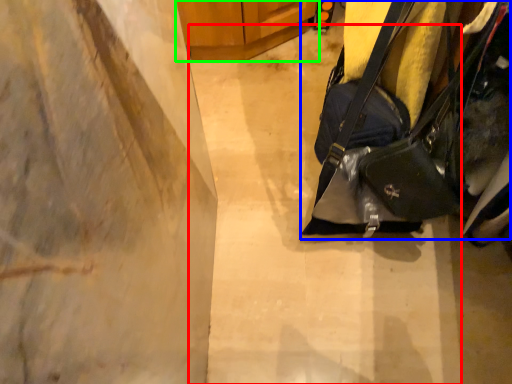
Question: Which object is positioned farthest from concrete (highlighted by a red box)? Select from handbag (highlighted by a blue box) and furniture (highlighted by a green box).

Choices:
 (A) handbag
 (B) furniture

Answer: (B)